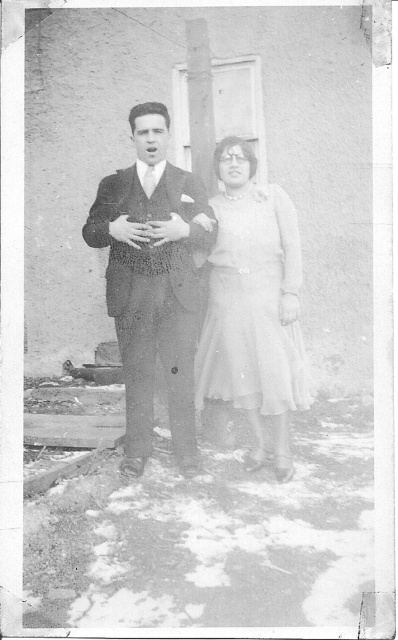
You are standing in a museum and see the vintage photograph described. The museum has a rule that visitors must stay at least 15 feet away from all displayed artworks. Can you approach the smooth dark suit at center in the photograph without violating the museum rule?

The smooth dark suit at center is 14.22 feet away from the viewer. Since the museum requires staying at least 15 feet away, approaching closer would violate the rule. Maintain the required distance.

In the scene shown: You are a photographer analyzing this vintage black and white image. You notice two central figures wearing the smooth dark suit at center and the white sheer dress at center. Which clothing item is located to the left of the other?

The smooth dark suit at center is positioned on the left side of white sheer dress at center.